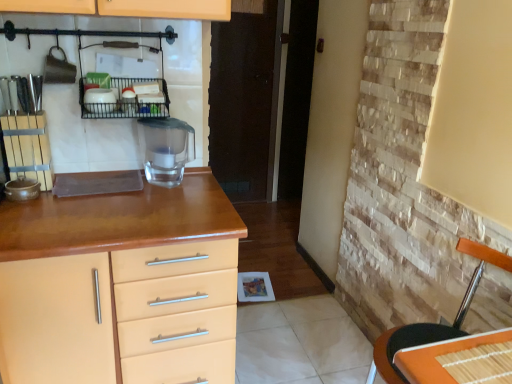
Identify the location of transparent glass water filter at center. This screenshot has height=384, width=512. (165, 149).

Describe the element at coordinates (120, 286) in the screenshot. I see `matte wood chest of drawers at left` at that location.

Measure the distance between black wire rack at upper center and camera.

black wire rack at upper center is 4.71 feet away from camera.

Where is `transparent glass water filter at center`? transparent glass water filter at center is located at coordinates (165, 149).

From the image's perspective, would you say matte wood chest of drawers at left is shown under black wire rack at upper center?

Indeed, from the image's perspective, matte wood chest of drawers at left is shown beneath black wire rack at upper center.

Is matte wood chest of drawers at left facing away from black wire rack at upper center?

matte wood chest of drawers at left is not turned away from black wire rack at upper center.

In the scene shown: Is black wire rack at upper center a part of matte wood chest of drawers at left?

No, black wire rack at upper center is not a part of matte wood chest of drawers at left.

Is there a large distance between orange woven mat at right and orange bamboo placemat at lower right?

No, orange woven mat at right is not far away from orange bamboo placemat at lower right.

Is orange woven mat at right spatially inside orange bamboo placemat at lower right, or outside of it?

orange woven mat at right cannot be found inside orange bamboo placemat at lower right.

How distant is orange woven mat at right from orange bamboo placemat at lower right?

orange woven mat at right and orange bamboo placemat at lower right are 36.60 centimeters apart.

Who is smaller, transparent glass water filter at center or orange bamboo placemat at lower right?

With smaller size is orange bamboo placemat at lower right.

Are transparent glass water filter at center and orange bamboo placemat at lower right far apart?

That's right, there is a large distance between transparent glass water filter at center and orange bamboo placemat at lower right.

Considering the positions of points (154, 147) and (510, 374), is point (154, 147) closer to camera compared to point (510, 374)?

No, (154, 147) is behind (510, 374).

Looking at this image, is transparent glass water filter at center completely or partially outside of orange bamboo placemat at lower right?

Yes, transparent glass water filter at center is not within orange bamboo placemat at lower right.

Based on the photo, could you tell me if orange woven mat at right is turned towards transparent glass water filter at center?

No, orange woven mat at right does not turn towards transparent glass water filter at center.

Is orange woven mat at right not inside transparent glass water filter at center?

Yes.

Considering the sizes of orange woven mat at right and transparent glass water filter at center in the image, is orange woven mat at right bigger or smaller than transparent glass water filter at center?

Considering their sizes, orange woven mat at right takes up more space than transparent glass water filter at center.

Would you say orange woven mat at right is a long distance from transparent glass water filter at center?

orange woven mat at right is positioned a significant distance from transparent glass water filter at center.

Is orange bamboo placemat at lower right facing away from transparent glass water filter at center?

That's not correct — orange bamboo placemat at lower right is not looking away from transparent glass water filter at center.

Who is shorter, orange bamboo placemat at lower right or transparent glass water filter at center?

With less height is orange bamboo placemat at lower right.

Considering the positions of points (458, 344) and (165, 176), is point (458, 344) farther from camera compared to point (165, 176)?

No.

Locate an element on the screen. table that appears in front of the transparent glass water filter at center is located at coordinates (460, 360).

Looking at this image, which is closer to the camera, [167,177] or [101,279]?

Point [167,177] is farther from the camera than point [101,279].

Locate an element on the screen. This screenshot has height=384, width=512. appliance located behind the matte wood chest of drawers at left is located at coordinates point(165,149).

Which is behind, transparent glass water filter at center or matte wood chest of drawers at left?

Positioned behind is transparent glass water filter at center.

Looking at their sizes, would you say transparent glass water filter at center is wider or thinner than matte wood chest of drawers at left?

In the image, transparent glass water filter at center appears to be more narrow than matte wood chest of drawers at left.

From their relative heights in the image, would you say black wire rack at upper center is taller or shorter than orange bamboo placemat at lower right?

black wire rack at upper center is taller than orange bamboo placemat at lower right.

From the picture: Is black wire rack at upper center bigger than orange bamboo placemat at lower right?

Correct, black wire rack at upper center is larger in size than orange bamboo placemat at lower right.

At what (x,y) coordinates should I click in order to perform the action: click on shelf that is behind the matte wood chest of drawers at left. Please return your answer as a coordinate pair (x, y). The image size is (512, 384). Looking at the image, I should click on (128, 101).

Image resolution: width=512 pixels, height=384 pixels. What are the coordinates of `table above the orange woven mat at right (from the image's perspective)` in the screenshot? It's located at (460, 360).

From the image, which object appears to be nearer to orange woven mat at right, orange bamboo placemat at lower right or black wire rack at upper center?

The object closer to orange woven mat at right is orange bamboo placemat at lower right.

Based on their spatial positions, is black wire rack at upper center or transparent glass water filter at center closer to orange woven mat at right?

Among the two, transparent glass water filter at center is located nearer to orange woven mat at right.

Looking at the image, which one is located closer to black wire rack at upper center, orange woven mat at right or transparent glass water filter at center?

transparent glass water filter at center lies closer to black wire rack at upper center than the other object.

Estimate the real-world distances between objects in this image. Which object is closer to black wire rack at upper center, transparent glass water filter at center or orange bamboo placemat at lower right?

transparent glass water filter at center is closer to black wire rack at upper center.

Estimate the real-world distances between objects in this image. Which object is further from matte wood chest of drawers at left, orange woven mat at right or transparent glass water filter at center?

Based on the image, orange woven mat at right appears to be further to matte wood chest of drawers at left.

Looking at the image, which one is located closer to orange bamboo placemat at lower right, transparent glass water filter at center or matte wood chest of drawers at left?

matte wood chest of drawers at left.

Considering their positions, is orange bamboo placemat at lower right positioned further to matte wood chest of drawers at left than black wire rack at upper center?

The object further to matte wood chest of drawers at left is orange bamboo placemat at lower right.

Looking at this image, looking at the image, which one is located further to black wire rack at upper center, matte wood chest of drawers at left or orange bamboo placemat at lower right?

orange bamboo placemat at lower right lies further to black wire rack at upper center than the other object.

You are a GUI agent. You are given a task and a screenshot of the screen. Output one action in this format:
    pyautogui.click(x=<x>, y=<y>)
    Task: Click on the appliance between matte wood chest of drawers at left and orange woven mat at right from left to right
    
    Given the screenshot: What is the action you would take?
    pyautogui.click(x=165, y=149)

Identify the location of appliance that lies between black wire rack at upper center and matte wood chest of drawers at left from top to bottom. (165, 149).

Find the location of a particular element. appliance located between matte wood chest of drawers at left and orange bamboo placemat at lower right in the left-right direction is located at coordinates (165, 149).

Where is `chair located between matte wood chest of drawers at left and orange bamboo placemat at lower right in the left-right direction`? Image resolution: width=512 pixels, height=384 pixels. chair located between matte wood chest of drawers at left and orange bamboo placemat at lower right in the left-right direction is located at coordinates (432, 323).